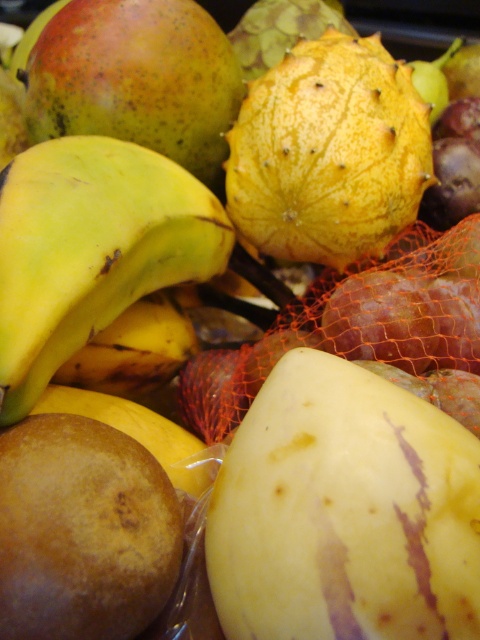
Which of these two, yellow matte banana at left or yellow spiky fruit at center, stands taller?

yellow spiky fruit at center

Where is `yellow matte banana at left`? yellow matte banana at left is located at coordinates (92, 250).

Is point (71, 305) positioned in front of point (414, 99)?

Yes, point (71, 305) is closer to viewer.

What are the coordinates of `yellow matte banana at left` in the screenshot? It's located at (92, 250).

Can you confirm if yellow spiky fruit at center is thinner than brown matte potato at lower left?

No.

Is point (386, 76) farther from viewer compared to point (12, 458)?

That is True.

Find the location of `yellow spiky fruit at center`. yellow spiky fruit at center is located at coordinates (328, 152).

Which is more to the right, yellow matte banana at left or brown matte potato at lower left?

brown matte potato at lower left

Who is positioned more to the left, yellow matte banana at left or brown matte potato at lower left?

yellow matte banana at left

Locate an element on the screen. Image resolution: width=480 pixels, height=640 pixels. yellow matte banana at left is located at coordinates (92, 250).